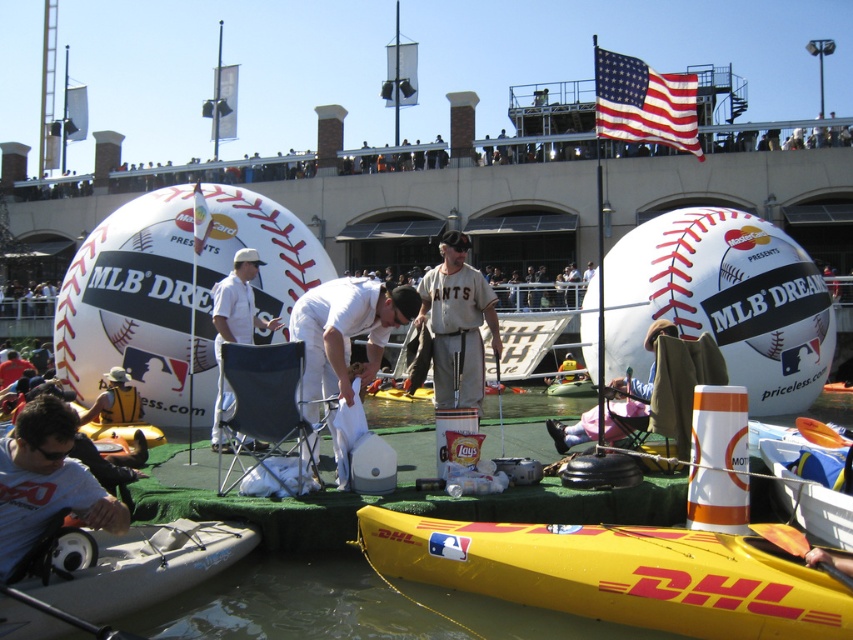
Does yellow plastic kayak at lower center appear under white fabric chair at center?

Yes, yellow plastic kayak at lower center is below white fabric chair at center.

Is point (791, 602) less distant than point (225, 392)?

Yes.

Identify the location of yellow plastic kayak at lower center. (618, 573).

Who is higher up, gray cotton t-shirt at lower left or white matte baseball cap at center?

white matte baseball cap at center

Which of these two, gray cotton t-shirt at lower left or white matte baseball cap at center, stands taller?

white matte baseball cap at center

Locate an element on the screen. Image resolution: width=853 pixels, height=640 pixels. gray cotton t-shirt at lower left is located at coordinates (45, 481).

You are a GUI agent. You are given a task and a screenshot of the screen. Output one action in this format:
    pyautogui.click(x=<x>, y=<y>)
    Task: Click on the gray cotton t-shirt at lower left
    This screenshot has height=640, width=853.
    Given the screenshot: What is the action you would take?
    pyautogui.click(x=45, y=481)

Where is `yellow plastic kayak at lower center`? yellow plastic kayak at lower center is located at coordinates (618, 573).

Can you confirm if yellow plastic kayak at lower center is positioned to the left of gray cotton t-shirt at lower left?

In fact, yellow plastic kayak at lower center is to the right of gray cotton t-shirt at lower left.

Does point (570, 525) lie in front of point (68, 467)?

No, (570, 525) is further to viewer.

The width and height of the screenshot is (853, 640). I want to click on yellow plastic kayak at lower center, so click(x=618, y=573).